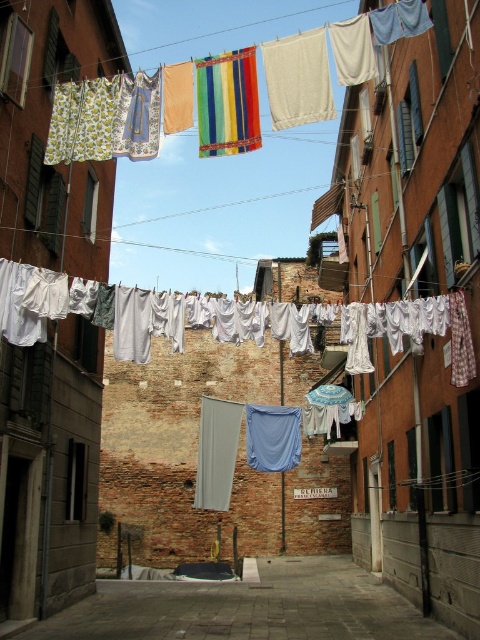
Can you confirm if smooth concrete pavement at center is thinner than multicolored fabric at upper center?

Incorrect, smooth concrete pavement at center's width is not less than multicolored fabric at upper center's.

Consider the image. Does smooth concrete pavement at center come behind multicolored fabric at upper center?

Yes.

I want to click on smooth concrete pavement at center, so click(248, 608).

Between smooth concrete pavement at center and white fabric at center, which one has less height?

Standing shorter between the two is white fabric at center.

Image resolution: width=480 pixels, height=640 pixels. What do you see at coordinates (248, 608) in the screenshot?
I see `smooth concrete pavement at center` at bounding box center [248, 608].

The height and width of the screenshot is (640, 480). I want to click on smooth concrete pavement at center, so click(248, 608).

Between point (285, 102) and point (391, 330), which one is positioned in front?

Positioned in front is point (391, 330).

Can you confirm if multicolored fabric at upper center is positioned to the right of white fabric at center?

Incorrect, multicolored fabric at upper center is not on the right side of white fabric at center.

Image resolution: width=480 pixels, height=640 pixels. I want to click on multicolored fabric at upper center, so 335,60.

You are a GUI agent. You are given a task and a screenshot of the screen. Output one action in this format:
    pyautogui.click(x=<x>, y=<y>)
    Task: Click on the multicolored fabric at upper center
    This screenshot has height=640, width=480.
    Given the screenshot: What is the action you would take?
    pyautogui.click(x=335, y=60)